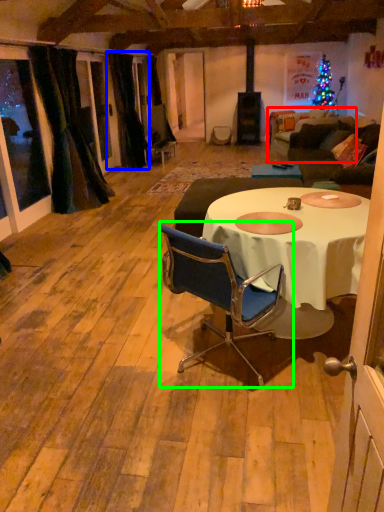
Question: Which object is the farthest from couch (highlighted by a red box)? Choose among these: curtain (highlighted by a blue box) or chair (highlighted by a green box).

Choices:
 (A) curtain
 (B) chair

Answer: (B)